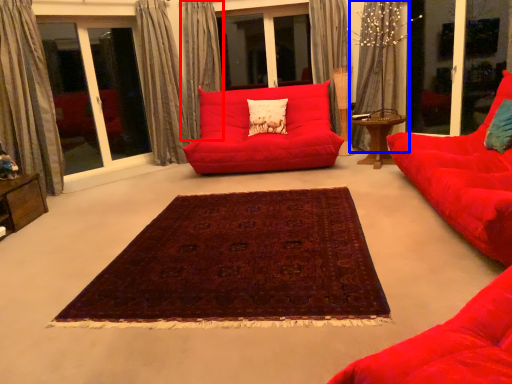
Question: Which object appears closest to the camera in this image, curtain (highlighted by a red box) or curtain (highlighted by a blue box)?

Choices:
 (A) curtain
 (B) curtain

Answer: (B)